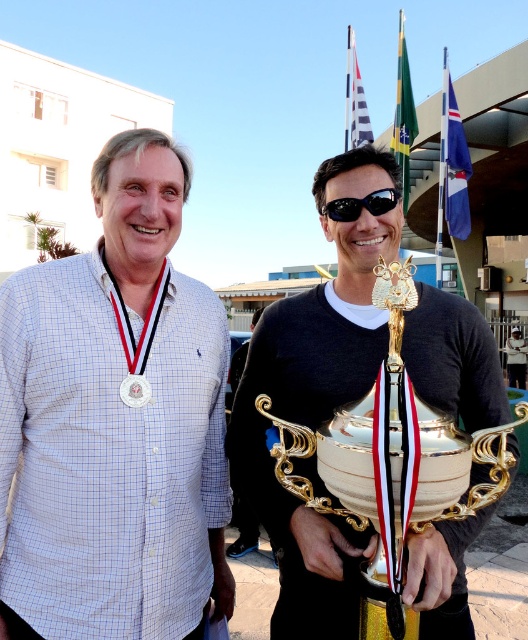
You are a photographer at a sports event. You need to capture a photo where the gold metallic medal at center is visible without being blocked by the white fabric flag at upper center. Based on their positions, is this possible?

The white fabric flag at upper center is located above the gold metallic medal at center, so if positioned correctly, the photographer can angle the shot so the medal is visible below the flag without obstruction.

You are a photographer at a sports event. You need to capture a photo of the blue fabric flag at upper right and the black plastic goggles at center. From the photographer viewpoint, which object is positioned more to the right?

The blue fabric flag at upper right is positioned more to the right than the black plastic goggles at center.